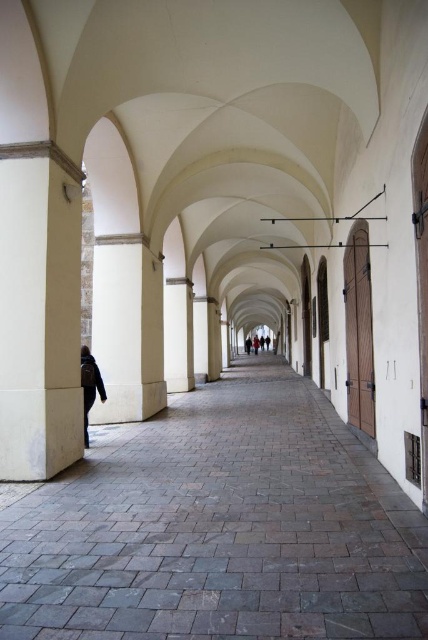
You are standing in the arcade and see the gray stone path at center and the light brown leather shoes at center. Which object is positioned to the left of the other?

The gray stone path at center is to the left of light brown leather shoes at center.

You are standing in the arcade and see the gray stone path at center and the dark gray fabric jacket at center. Which object is closer to you?

The dark gray fabric jacket at center is closer to you because it is positioned above the gray stone path at center, which is beneath it.

Based on the photo, you are standing in the arcade and want to walk from the gray stone path at center to the light brown leather shoes at center. Which object will you step on first?

You will step on the gray stone path at center first because it is larger in size than the light brown leather shoes at center, so it is more likely to be underfoot.